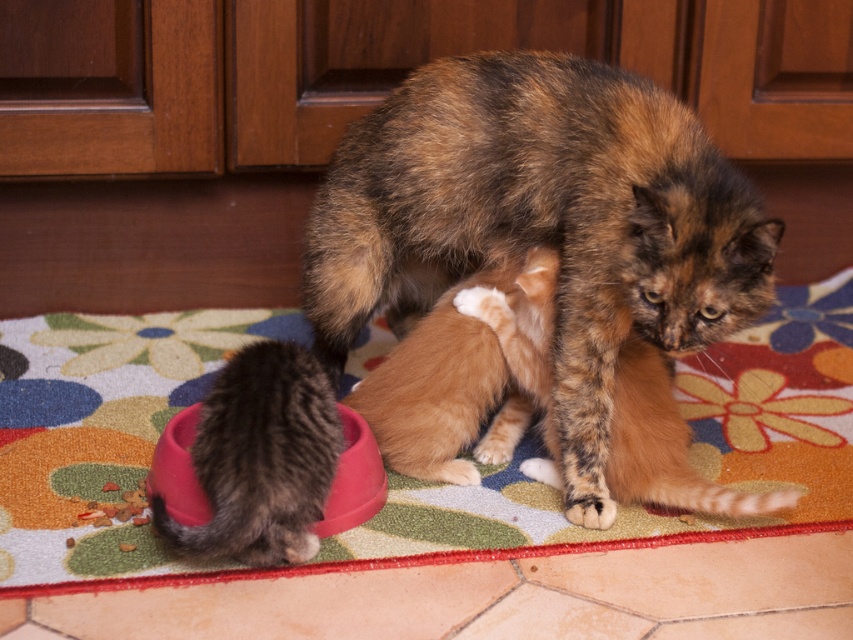
You are a robotic cat toy that is 12 inches long. You want to move from your current position to the soft fur paw at lower center without getting too close to the fluffy tortoiseshell cat at center. Is there enough space between them for you to pass through safely?

The distance between the fluffy tortoiseshell cat at center and the soft fur paw at lower center is 14.17 inches. Since the robotic cat toy is 12 inches long, there is enough space to pass through safely as 12 inches is less than 14.17 inches.